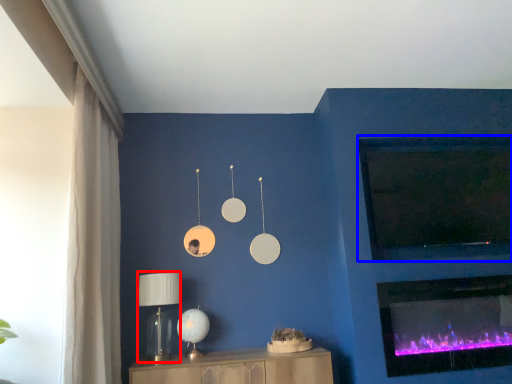
Question: Which point is closer to the camera, table lamp (highlighted by a red box) or window screen (highlighted by a blue box)?

Choices:
 (A) table lamp
 (B) window screen

Answer: (A)